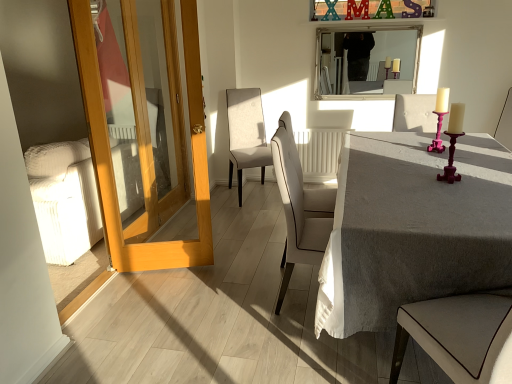
This screenshot has height=384, width=512. What do you see at coordinates (148, 141) in the screenshot?
I see `light wood door at left` at bounding box center [148, 141].

What do you see at coordinates (368, 62) in the screenshot? I see `silver/metallic mirror at upper center` at bounding box center [368, 62].

In the scene shown: In order to face gray linen table at center, should I rotate leftwards or rightwards?

To face it directly, rotate right by 21.895 degrees.

Find the location of a particular element. This screenshot has width=512, height=384. beige fabric chair at center, the 3th chair from the front is located at coordinates (246, 134).

Describe the element at coordinates (415, 113) in the screenshot. I see `pink velvet chair at upper right, which is the 1th chair in right-to-left order` at that location.

At what (x,y) coordinates should I click in order to perform the action: click on light wood door at left. Please return your answer as a coordinate pair (x, y). The height and width of the screenshot is (384, 512). Looking at the image, I should click on (148, 141).

Which is less distant, (292, 196) or (117, 201)?

Point (292, 196).

Between white leather chair at center, the second chair in the right-to-left sequence, and light wood door at left, which one has larger size?

Bigger between the two is white leather chair at center, the second chair in the right-to-left sequence.

At what (x,y) coordinates should I click in order to perform the action: click on chair lying in front of the light wood door at left. Please return your answer as a coordinate pair (x, y). Image resolution: width=512 pixels, height=384 pixels. Looking at the image, I should click on (298, 210).

Does white leather chair at center, arranged as the first chair when viewed from the front, have a lesser height compared to light wood door at left?

Indeed, white leather chair at center, arranged as the first chair when viewed from the front, has a lesser height compared to light wood door at left.

Is gray linen table at center smaller than light wood door at left?

No.

From a real-world perspective, is gray linen table at center positioned over light wood door at left based on gravity?

No, from a real-world perspective, gray linen table at center is not over light wood door at left

Is light wood door at left surrounded by gray linen table at center?

Actually, light wood door at left is outside gray linen table at center.

Could you tell me if gray linen table at center is facing light wood door at left?

Yes, gray linen table at center faces towards light wood door at left.

Which object is wider, silver/metallic mirror at upper center or white leather chair at center, the second chair in the right-to-left sequence?

With larger width is white leather chair at center, the second chair in the right-to-left sequence.

Considering the positions of objects silver/metallic mirror at upper center and white leather chair at center, which ranks as the 2th chair in left-to-right order, in the image provided, who is more to the right, silver/metallic mirror at upper center or white leather chair at center, which ranks as the 2th chair in left-to-right order,?

From the viewer's perspective, silver/metallic mirror at upper center appears more on the right side.

Which object is further away from the camera taking this photo, silver/metallic mirror at upper center or white leather chair at center, the second chair in the right-to-left sequence?

silver/metallic mirror at upper center is behind.

From a real-world perspective, which chair is the 2nd one underneath the silver/metallic mirror at upper center? Please provide its 2D coordinates.

[(298, 210)]

From the image's perspective, is pink velvet chair at upper right, which is the 3th chair from left to right, positioned above or below silver/metallic mirror at upper center?

Based on their image positions, pink velvet chair at upper right, which is the 3th chair from left to right, is located beneath silver/metallic mirror at upper center.

Which is correct: pink velvet chair at upper right, which is the 1th chair in right-to-left order, is inside silver/metallic mirror at upper center, or outside of it?

pink velvet chair at upper right, which is the 1th chair in right-to-left order, cannot be found inside silver/metallic mirror at upper center.

Based on the photo, which is behind, pink velvet chair at upper right, the second chair viewed from the back, or silver/metallic mirror at upper center?

silver/metallic mirror at upper center is further from the camera.

At what (x,y) coordinates should I click in order to perform the action: click on mirror behind the pink velvet chair at upper right, the 2th chair when ordered from front to back. Please return your answer as a coordinate pair (x, y). The width and height of the screenshot is (512, 384). Looking at the image, I should click on (368, 62).

In the image, is beige fabric chair at center, marked as the 1th chair in a left-to-right arrangement, on the left side or the right side of pink velvet chair at upper right, the second chair viewed from the back?

Clearly, beige fabric chair at center, marked as the 1th chair in a left-to-right arrangement, is on the left of pink velvet chair at upper right, the second chair viewed from the back, in the image.

You are a GUI agent. You are given a task and a screenshot of the screen. Output one action in this format:
    pyautogui.click(x=<x>, y=<y>)
    Task: Click on the chair behind the pink velvet chair at upper right, which is the 1th chair in right-to-left order
    
    Given the screenshot: What is the action you would take?
    pyautogui.click(x=246, y=134)

Is beige fabric chair at center, acting as the first chair starting from the back, far from pink velvet chair at upper right, which is the 3th chair from left to right?

Indeed, beige fabric chair at center, acting as the first chair starting from the back, is not near pink velvet chair at upper right, which is the 3th chair from left to right.

Considering the sizes of objects beige fabric chair at center, acting as the first chair starting from the back, and pink velvet chair at upper right, the second chair viewed from the back, in the image provided, who is bigger, beige fabric chair at center, acting as the first chair starting from the back, or pink velvet chair at upper right, the second chair viewed from the back,?

With larger size is beige fabric chair at center, acting as the first chair starting from the back.

Considering the sizes of objects beige fabric chair at center, the 3th chair from the front, and light wood door at left in the image provided, who is wider, beige fabric chair at center, the 3th chair from the front, or light wood door at left?

With larger width is beige fabric chair at center, the 3th chair from the front.

Is beige fabric chair at center, which is the third chair from right to left, touching light wood door at left?

No.

Which of these two, beige fabric chair at center, the 3th chair from the front, or light wood door at left, stands taller?

With more height is light wood door at left.

From a real-world perspective, does white leather chair at center, arranged as the first chair when viewed from the front, stand above silver/metallic mirror at upper center?

No, from a real-world perspective, white leather chair at center, arranged as the first chair when viewed from the front, is not on top of silver/metallic mirror at upper center.

What's the angular difference between white leather chair at center, arranged as the first chair when viewed from the front, and silver/metallic mirror at upper center's facing directions?

They differ by 89.5 degrees in their facing directions.

Identify the location of mirror located on the right of white leather chair at center, which ranks as the 2th chair in left-to-right order. (368, 62).

Which is farther from the camera, (x=288, y=227) or (x=345, y=51)?

The point (x=345, y=51) is more distant.

Identify the location of chair located in front of the light wood door at left. The width and height of the screenshot is (512, 384). (298, 210).

Where is `table below the light wood door at left (from a real-world perspective)`? The width and height of the screenshot is (512, 384). table below the light wood door at left (from a real-world perspective) is located at coordinates (412, 228).

Based on their spatial positions, is pink velvet chair at upper right, which is the 1th chair in right-to-left order, or gray linen table at center further from light wood door at left?

Among the two, pink velvet chair at upper right, which is the 1th chair in right-to-left order, is located further to light wood door at left.

Estimate the real-world distances between objects in this image. Which object is closer to gray linen table at center, white leather chair at center, arranged as the first chair when viewed from the front, or beige fabric chair at center, marked as the 1th chair in a left-to-right arrangement?

white leather chair at center, arranged as the first chair when viewed from the front, is closer to gray linen table at center.

Estimate the real-world distances between objects in this image. Which object is closer to gray linen table at center, light wood door at left or silver/metallic mirror at upper center?

Among the two, light wood door at left is located nearer to gray linen table at center.

When comparing their distances from light wood door at left, does silver/metallic mirror at upper center or white leather chair at center, arranged as the first chair when viewed from the front, seem closer?

white leather chair at center, arranged as the first chair when viewed from the front, is closer to light wood door at left.

When comparing their distances from gray linen table at center, does beige fabric chair at center, which is the third chair from right to left, or silver/metallic mirror at upper center seem closer?

Based on the image, silver/metallic mirror at upper center appears to be nearer to gray linen table at center.

Estimate the real-world distances between objects in this image. Which object is further from white leather chair at center, which ranks as the 2th chair in left-to-right order, silver/metallic mirror at upper center or light wood door at left?

The object further to white leather chair at center, which ranks as the 2th chair in left-to-right order, is silver/metallic mirror at upper center.

Considering their positions, is silver/metallic mirror at upper center positioned closer to gray linen table at center than white leather chair at center, which ranks as the 2th chair in left-to-right order?

Based on the image, white leather chair at center, which ranks as the 2th chair in left-to-right order, appears to be nearer to gray linen table at center.

When comparing their distances from white leather chair at center, which ranks as the 2th chair in left-to-right order, does pink velvet chair at upper right, which is the 1th chair in right-to-left order, or silver/metallic mirror at upper center seem closer?

pink velvet chair at upper right, which is the 1th chair in right-to-left order, is closer to white leather chair at center, which ranks as the 2th chair in left-to-right order.

Locate an element on the screen. The height and width of the screenshot is (384, 512). door positioned between white leather chair at center, the second chair in the right-to-left sequence, and silver/metallic mirror at upper center from near to far is located at coordinates (148, 141).

Where is `table located between light wood door at left and pink velvet chair at upper right, the 2th chair when ordered from front to back, in the left-right direction`? This screenshot has height=384, width=512. table located between light wood door at left and pink velvet chair at upper right, the 2th chair when ordered from front to back, in the left-right direction is located at coordinates (412, 228).

Locate an element on the screen. The width and height of the screenshot is (512, 384). door positioned between white leather chair at center, which ranks as the 2th chair in left-to-right order, and beige fabric chair at center, marked as the 1th chair in a left-to-right arrangement, from near to far is located at coordinates (148, 141).

The image size is (512, 384). Find the location of `door between gray linen table at center and beige fabric chair at center, which is the third chair from right to left, along the z-axis`. door between gray linen table at center and beige fabric chair at center, which is the third chair from right to left, along the z-axis is located at coordinates (148, 141).